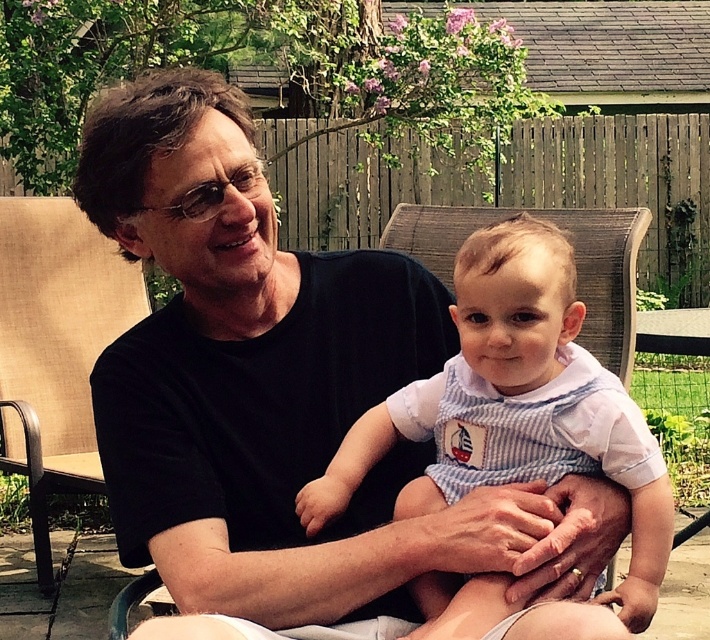
Which is above, black matte shirt at center or blue striped overalls at center?

black matte shirt at center

Image resolution: width=710 pixels, height=640 pixels. Identify the location of black matte shirt at center. (289, 397).

Who is more forward, (324, 376) or (432, 593)?

Positioned in front is point (432, 593).

Locate an element on the screen. black matte shirt at center is located at coordinates (289, 397).